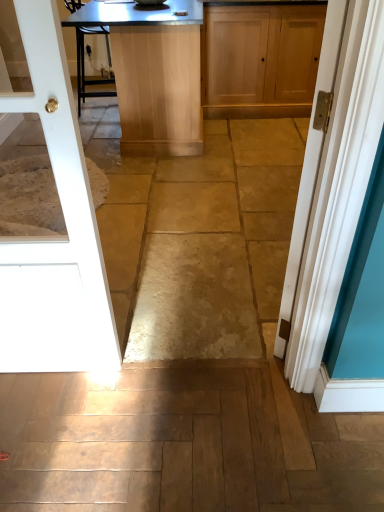
The width and height of the screenshot is (384, 512). Describe the element at coordinates (57, 238) in the screenshot. I see `white glossy door at left, arranged as the first door when viewed from the left` at that location.

How much space does white glossy door at left, arranged as the first door when viewed from the left, occupy horizontally?

It is 9.97 centimeters.

Measure the distance between matte wood cabinet at upper center and camera.

The distance of matte wood cabinet at upper center from camera is 3.18 meters.

This screenshot has height=512, width=384. Describe the element at coordinates (151, 72) in the screenshot. I see `light brown wooden table at center` at that location.

What do you see at coordinates (310, 164) in the screenshot?
I see `white painted wood door at right, positioned as the 2th door in left-to-right order` at bounding box center [310, 164].

I want to click on white glossy door at left, acting as the second door starting from the right, so click(x=57, y=238).

Can we say white glossy door at left, arranged as the first door when viewed from the left, lies outside white painted wood door at right, marked as the first door in a right-to-left arrangement?

Yes, white glossy door at left, arranged as the first door when viewed from the left, is located beyond the bounds of white painted wood door at right, marked as the first door in a right-to-left arrangement.

Considering the relative sizes of white glossy door at left, arranged as the first door when viewed from the left, and white painted wood door at right, marked as the first door in a right-to-left arrangement, in the image provided, is white glossy door at left, arranged as the first door when viewed from the left, wider than white painted wood door at right, marked as the first door in a right-to-left arrangement,?

Yes, white glossy door at left, arranged as the first door when viewed from the left, is wider than white painted wood door at right, marked as the first door in a right-to-left arrangement.

From a real-world perspective, is white glossy door at left, arranged as the first door when viewed from the left, positioned above or below white painted wood door at right, positioned as the 2th door in left-to-right order?

white glossy door at left, arranged as the first door when viewed from the left, is above white painted wood door at right, positioned as the 2th door in left-to-right order.

Considering the relative positions of white glossy door at left, arranged as the first door when viewed from the left, and white painted wood door at right, marked as the first door in a right-to-left arrangement, in the image provided, is white glossy door at left, arranged as the first door when viewed from the left, to the right of white painted wood door at right, marked as the first door in a right-to-left arrangement, from the viewer's perspective?

Incorrect, white glossy door at left, arranged as the first door when viewed from the left, is not on the right side of white painted wood door at right, marked as the first door in a right-to-left arrangement.

Are light brown wooden table at center and matte wood cabinet at upper center located far from each other?

That's not correct — light brown wooden table at center is a little close to matte wood cabinet at upper center.

Considering the positions of objects light brown wooden table at center and matte wood cabinet at upper center in the image provided, who is more to the left, light brown wooden table at center or matte wood cabinet at upper center?

light brown wooden table at center.

Based on their sizes in the image, would you say light brown wooden table at center is bigger or smaller than matte wood cabinet at upper center?

light brown wooden table at center is bigger than matte wood cabinet at upper center.

From a real-world perspective, is light brown wooden table at center over matte wood cabinet at upper center?

Correct, in the physical world, light brown wooden table at center is higher than matte wood cabinet at upper center.

Find the location of a particular element. This screenshot has width=384, height=512. the 1st door above the matte wood cabinet at upper center (from a real-world perspective) is located at coordinates (310, 164).

Are matte wood cabinet at upper center and white painted wood door at right, positioned as the 2th door in left-to-right order, far apart?

Yes, matte wood cabinet at upper center and white painted wood door at right, positioned as the 2th door in left-to-right order, are quite far apart.

Which is more distant, (207,98) or (308,187)?

The point (207,98) is behind.

Based on the photo, does light brown wooden table at center contain white painted wood door at right, marked as the first door in a right-to-left arrangement?

No, white painted wood door at right, marked as the first door in a right-to-left arrangement, is not surrounded by light brown wooden table at center.

Find the location of a particular element. door on the right of light brown wooden table at center is located at coordinates (310, 164).

How different are the orientations of light brown wooden table at center and white glossy door at left, acting as the second door starting from the right, in degrees?

The angular difference between light brown wooden table at center and white glossy door at left, acting as the second door starting from the right, is 93.3 degrees.

Is light brown wooden table at center placed right next to white glossy door at left, acting as the second door starting from the right?

They are not placed beside each other.

From a real-world perspective, is light brown wooden table at center positioned above or below white glossy door at left, arranged as the first door when viewed from the left?

From a real-world perspective, light brown wooden table at center is physically below white glossy door at left, arranged as the first door when viewed from the left.

Does light brown wooden table at center have a larger size compared to white glossy door at left, acting as the second door starting from the right?

Yes, light brown wooden table at center is bigger than white glossy door at left, acting as the second door starting from the right.

Which is in front, point (276, 333) or point (309, 83)?

Positioned in front is point (276, 333).

Is white painted wood door at right, marked as the first door in a right-to-left arrangement, positioned in front of matte wood cabinet at upper center?

Yes, the depth of white painted wood door at right, marked as the first door in a right-to-left arrangement, is less than that of matte wood cabinet at upper center.

From a real-world perspective, is white painted wood door at right, positioned as the 2th door in left-to-right order, positioned above or below matte wood cabinet at upper center?

white painted wood door at right, positioned as the 2th door in left-to-right order, is situated higher than matte wood cabinet at upper center in the real world.

Between white painted wood door at right, marked as the first door in a right-to-left arrangement, and matte wood cabinet at upper center, which one has larger size?

Bigger between the two is matte wood cabinet at upper center.

Looking at this image, is white painted wood door at right, marked as the first door in a right-to-left arrangement, facing away from white glossy door at left, acting as the second door starting from the right?

white painted wood door at right, marked as the first door in a right-to-left arrangement, does not have its back to white glossy door at left, acting as the second door starting from the right.

Between white painted wood door at right, positioned as the 2th door in left-to-right order, and white glossy door at left, acting as the second door starting from the right, which one appears on the right side from the viewer's perspective?

From the viewer's perspective, white painted wood door at right, positioned as the 2th door in left-to-right order, appears more on the right side.

Would you say white painted wood door at right, positioned as the 2th door in left-to-right order, is inside or outside white glossy door at left, arranged as the first door when viewed from the left?

white painted wood door at right, positioned as the 2th door in left-to-right order, is spatially situated outside white glossy door at left, arranged as the first door when viewed from the left.

Is the position of white painted wood door at right, marked as the first door in a right-to-left arrangement, less distant than that of white glossy door at left, arranged as the first door when viewed from the left?

No, white painted wood door at right, marked as the first door in a right-to-left arrangement, is further to the viewer.

Where is `door on the left of the white painted wood door at right, positioned as the 2th door in left-to-right order`? door on the left of the white painted wood door at right, positioned as the 2th door in left-to-right order is located at coordinates (57, 238).

You are a GUI agent. You are given a task and a screenshot of the screen. Output one action in this format:
    pyautogui.click(x=<x>, y=<y>)
    Task: Click on the cabinetry above the light brown wooden table at center (from the image's perspective)
    This screenshot has width=384, height=512.
    Given the screenshot: What is the action you would take?
    pyautogui.click(x=260, y=59)

When comparing their distances from light brown wooden table at center, does matte wood cabinet at upper center or white painted wood door at right, marked as the first door in a right-to-left arrangement, seem further?

Based on the image, white painted wood door at right, marked as the first door in a right-to-left arrangement, appears to be further to light brown wooden table at center.

Considering their positions, is matte wood cabinet at upper center positioned further to white glossy door at left, arranged as the first door when viewed from the left, than light brown wooden table at center?

Based on the image, matte wood cabinet at upper center appears to be further to white glossy door at left, arranged as the first door when viewed from the left.

When comparing their distances from matte wood cabinet at upper center, does white painted wood door at right, positioned as the 2th door in left-to-right order, or light brown wooden table at center seem closer?

The object closer to matte wood cabinet at upper center is light brown wooden table at center.

Looking at the image, which one is located further to white painted wood door at right, positioned as the 2th door in left-to-right order, matte wood cabinet at upper center or white glossy door at left, acting as the second door starting from the right?

matte wood cabinet at upper center is positioned further to the anchor white painted wood door at right, positioned as the 2th door in left-to-right order.

Which object lies nearer to the anchor point matte wood cabinet at upper center, white glossy door at left, arranged as the first door when viewed from the left, or white painted wood door at right, positioned as the 2th door in left-to-right order?

Based on the image, white painted wood door at right, positioned as the 2th door in left-to-right order, appears to be nearer to matte wood cabinet at upper center.

Looking at the image, which one is located further to matte wood cabinet at upper center, white glossy door at left, acting as the second door starting from the right, or light brown wooden table at center?

Based on the image, white glossy door at left, acting as the second door starting from the right, appears to be further to matte wood cabinet at upper center.

Consider the image. Considering their positions, is light brown wooden table at center positioned further to white glossy door at left, acting as the second door starting from the right, than matte wood cabinet at upper center?

matte wood cabinet at upper center lies further to white glossy door at left, acting as the second door starting from the right, than the other object.

Based on their spatial positions, is light brown wooden table at center or white painted wood door at right, positioned as the 2th door in left-to-right order, closer to matte wood cabinet at upper center?

light brown wooden table at center is positioned closer to the anchor matte wood cabinet at upper center.

This screenshot has width=384, height=512. Find the location of `table between white painted wood door at right, positioned as the 2th door in left-to-right order, and matte wood cabinet at upper center from front to back`. table between white painted wood door at right, positioned as the 2th door in left-to-right order, and matte wood cabinet at upper center from front to back is located at coordinates (151, 72).

Where is `door located between white glossy door at left, arranged as the first door when viewed from the left, and matte wood cabinet at upper center in the depth direction`? This screenshot has width=384, height=512. door located between white glossy door at left, arranged as the first door when viewed from the left, and matte wood cabinet at upper center in the depth direction is located at coordinates (310, 164).

Where is `table between white glossy door at left, acting as the second door starting from the right, and matte wood cabinet at upper center from front to back`? table between white glossy door at left, acting as the second door starting from the right, and matte wood cabinet at upper center from front to back is located at coordinates (151, 72).

Image resolution: width=384 pixels, height=512 pixels. What are the coordinates of `door between white glossy door at left, arranged as the first door when viewed from the left, and light brown wooden table at center from front to back` in the screenshot? It's located at (310, 164).